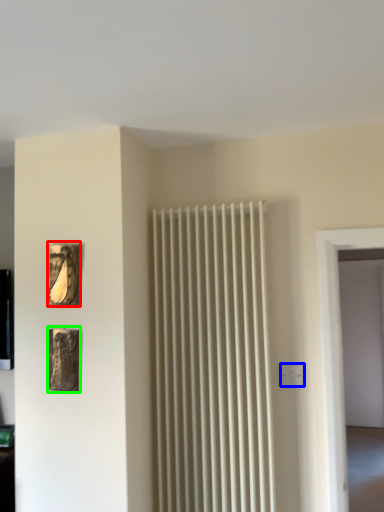
Question: Which is farther away from picture frame (highlighted by a red box)? electric outlet (highlighted by a blue box) or picture frame (highlighted by a green box)?

Choices:
 (A) electric outlet
 (B) picture frame

Answer: (A)